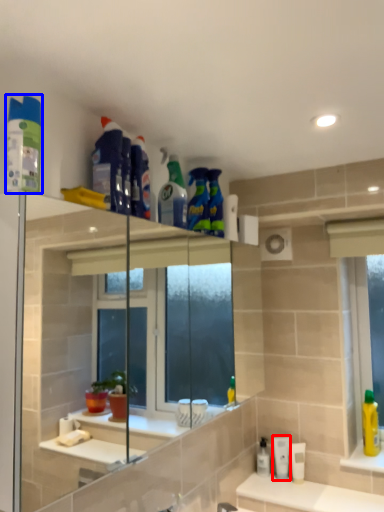
Question: Which point is closer to the camera, mouthwash (highlighted by a red box) or cleaning product (highlighted by a blue box)?

Choices:
 (A) mouthwash
 (B) cleaning product

Answer: (B)